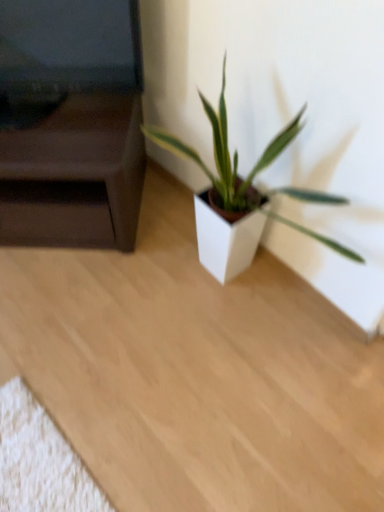
In order to face white matte planter at center, should I rotate leftwards or rightwards?

Turn right by 7.431 degrees to look at white matte planter at center.

Image resolution: width=384 pixels, height=512 pixels. Identify the location of white matte planter at center. (248, 174).

This screenshot has width=384, height=512. Describe the element at coordinates (248, 174) in the screenshot. I see `white matte planter at center` at that location.

Locate an element on the screen. white matte planter at center is located at coordinates point(248,174).